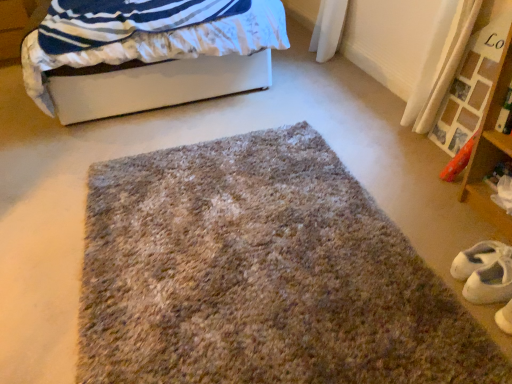
Where is `vacant region below fuzzy carpet at center (from a real-world perspective)`? The height and width of the screenshot is (384, 512). vacant region below fuzzy carpet at center (from a real-world perspective) is located at coordinates (229, 271).